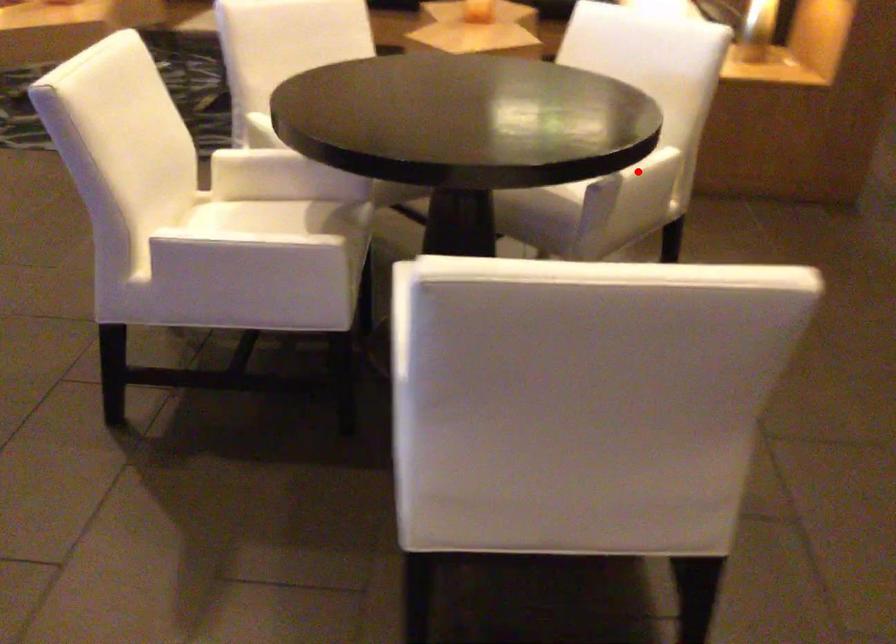
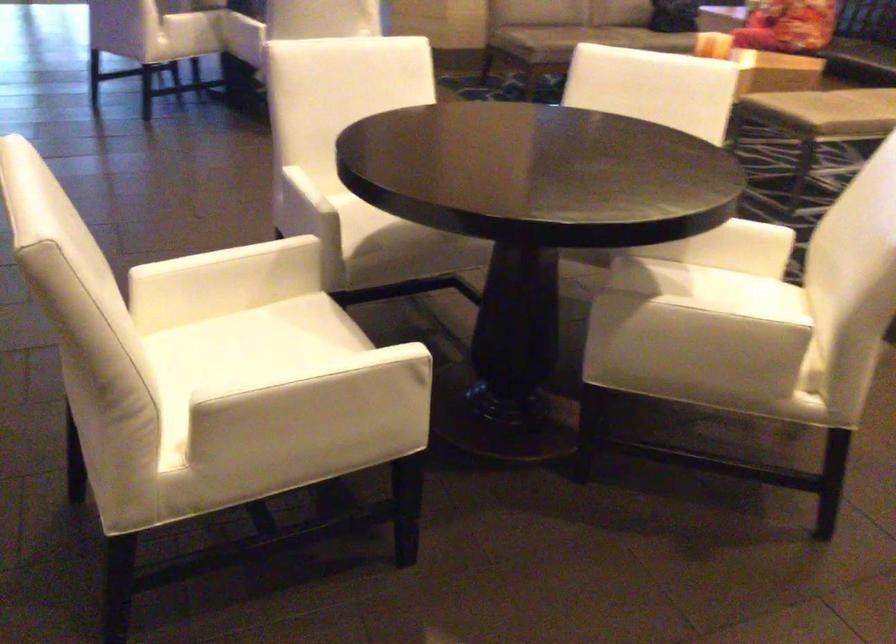
Where in the second image is the point corresponding to the highlighted location from the first image?

(699, 319)